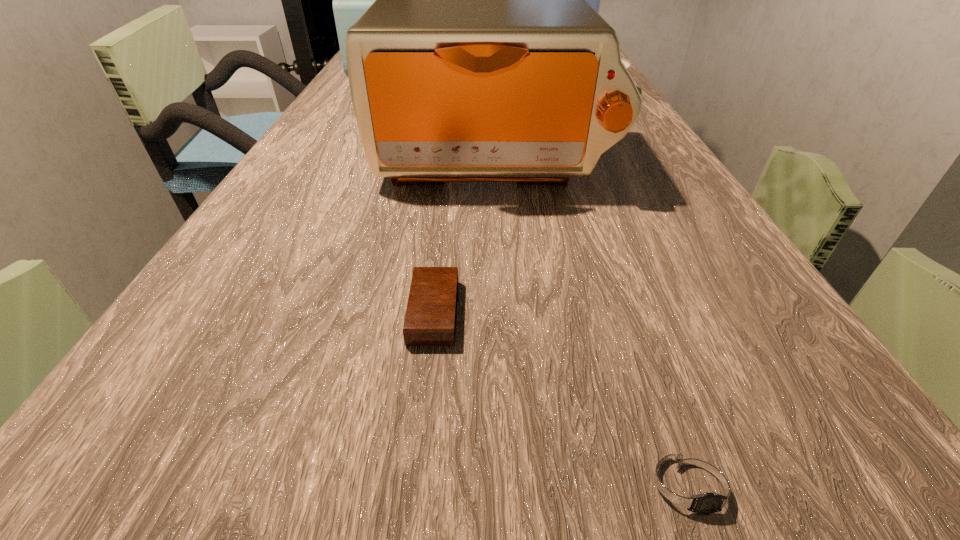
Find the location of `free space located 0.230m on the left of the soup bowl`. free space located 0.230m on the left of the soup bowl is located at coordinates (477, 92).

At what (x,y) coordinates should I click in order to perform the action: click on free space located on the front face of the alarm clock. Please return your answer as a coordinate pair (x, y). This screenshot has height=540, width=960. Looking at the image, I should click on (769, 312).

Locate an element on the screen. The height and width of the screenshot is (540, 960). water jug present at the far edge is located at coordinates (594, 0).

The height and width of the screenshot is (540, 960). Identify the location of radio receiver located at the far edge. (350, 0).

Find the location of a particular element. The height and width of the screenshot is (540, 960). object that is at the left edge is located at coordinates coord(350,0).

Where is `water jug that is at the right edge`? water jug that is at the right edge is located at coordinates (594, 0).

Locate an element on the screen. toaster oven at the right edge is located at coordinates (480, 61).

In order to click on soup bowl positioned at the right edge in this screenshot , I will do `click(627, 64)`.

Where is `object at the far left corner`? Image resolution: width=960 pixels, height=540 pixels. object at the far left corner is located at coordinates (350, 0).

Image resolution: width=960 pixels, height=540 pixels. Find the location of `object at the far right corner`. object at the far right corner is located at coordinates (594, 0).